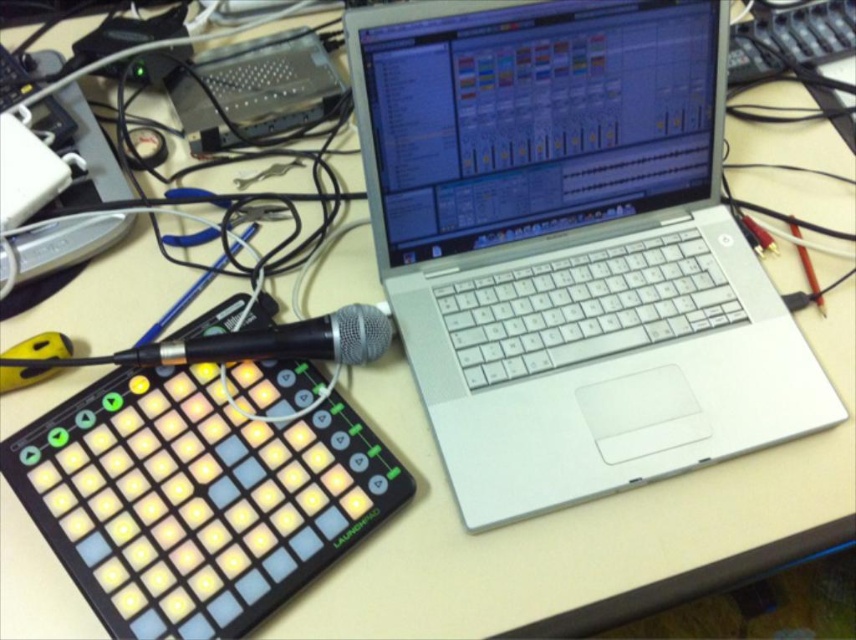
Does point (767, 333) come in front of point (150, 346)?

No, it is behind (150, 346).

Who is shorter, silver metallic laptop at center or black matte microphone at center-left?

Standing shorter between the two is black matte microphone at center-left.

Does point (678, 259) come in front of point (110, 358)?

That is False.

Find the location of `silver metallic laptop at center`. silver metallic laptop at center is located at coordinates (569, 246).